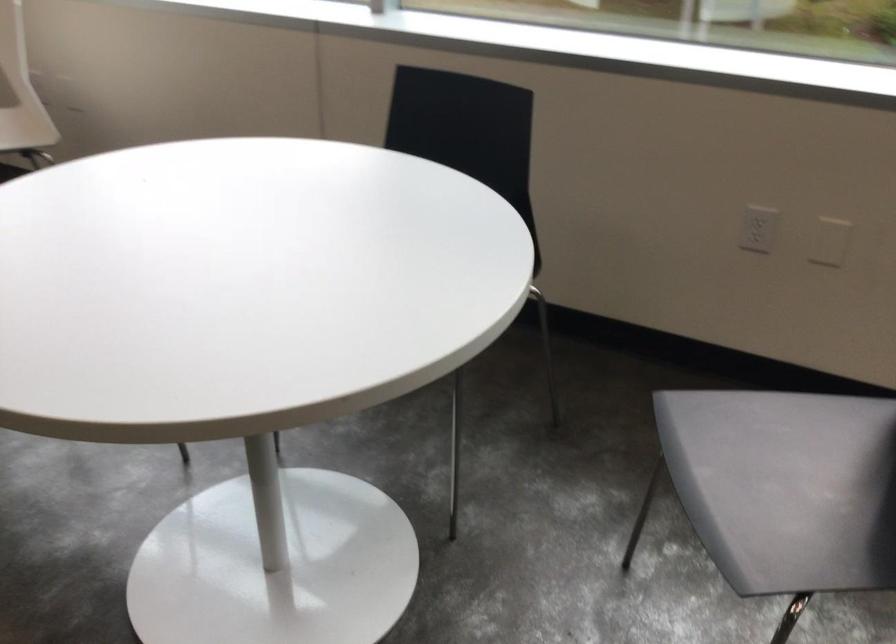
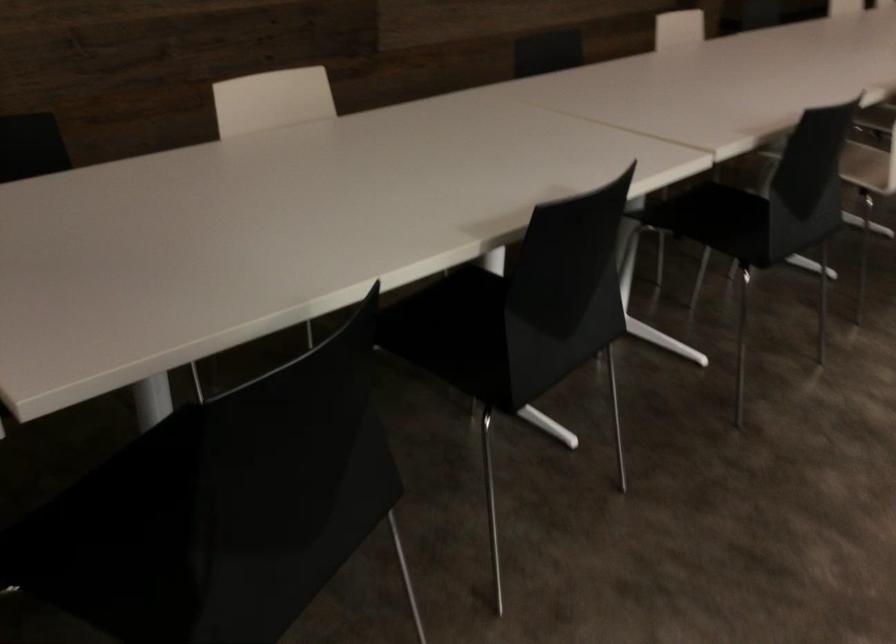
How did the camera likely rotate?

The rotation direction of the camera is left-down.